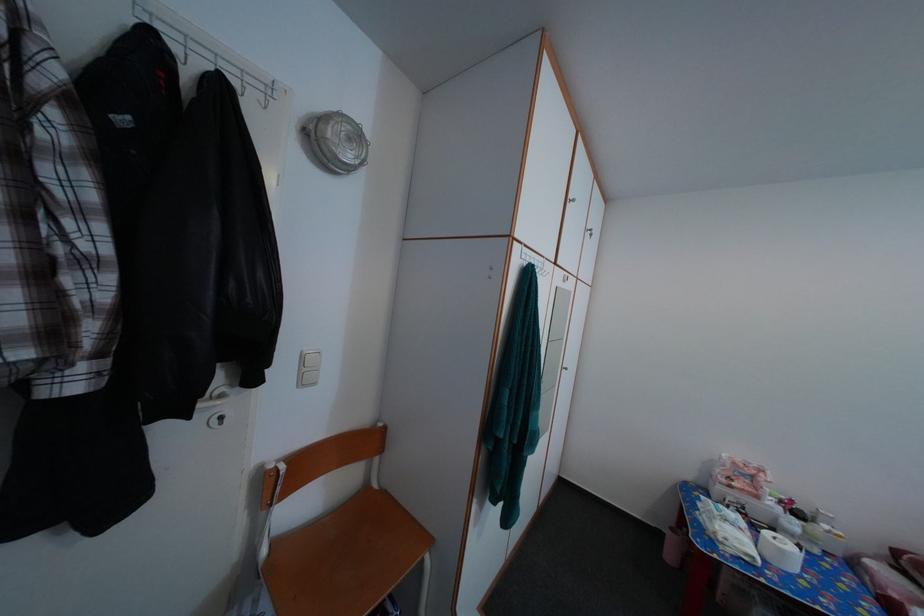
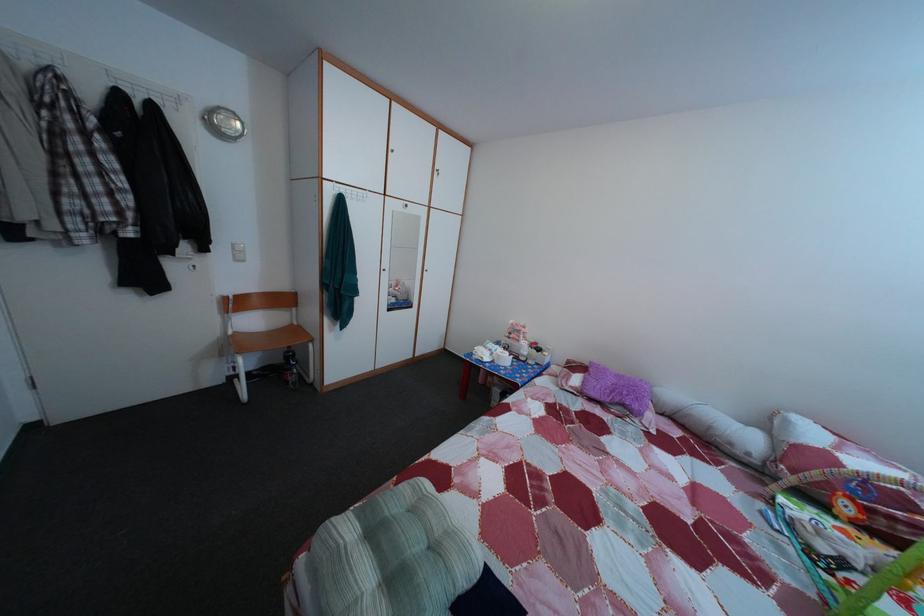
In the second image, find the point that corresponds to point 768,505 in the first image.

(528, 349)